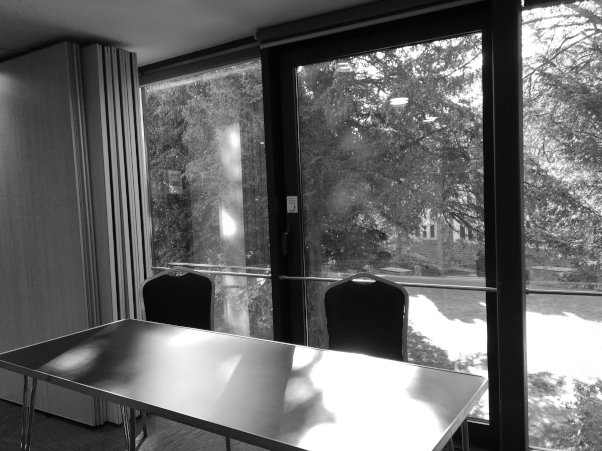
At what (x,y) coordinates should I click in order to perform the action: click on left door frame. Please return your answer as a coordinate pair (x, y). The width and height of the screenshot is (602, 451). Looking at the image, I should click on (141, 70).